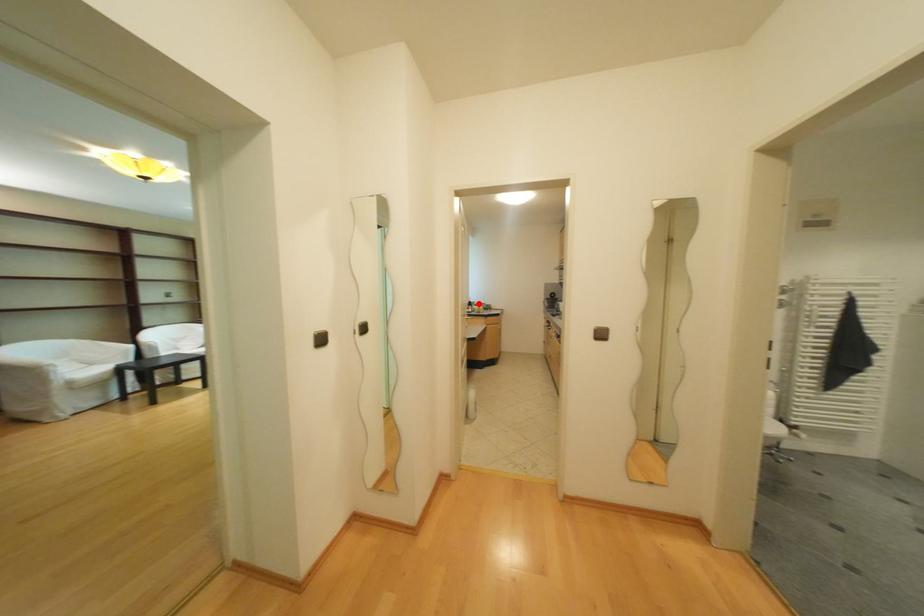
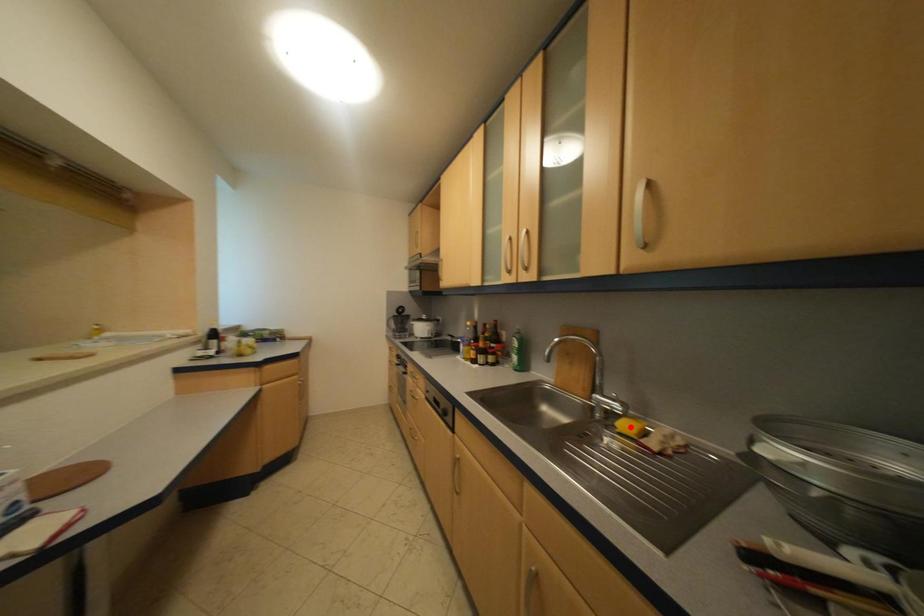
I am providing you with two images of the same scene from different viewpoints. A red point is marked on the first image and another point is marked on the second image. Are the points marked in image1 and image2 representing the same 3D position?

No